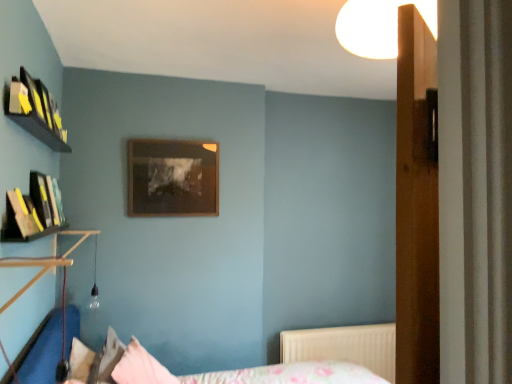
Question: From a real-world perspective, is floral fabric bed at lower center physically located above or below white textured radiator at lower right?

Choices:
 (A) above
 (B) below

Answer: (A)

Question: Looking at the image, does floral fabric bed at lower center seem bigger or smaller compared to white textured radiator at lower right?

Choices:
 (A) small
 (B) big

Answer: (B)

Question: Which object is positioned closest to the white glossy light fixture at upper center?

Choices:
 (A) pink fabric pillow at lower center, the 2th pillow in the left-to-right sequence
 (B) floral fabric bed at lower center
 (C) fluffy pink pillow at lower left, the 1th pillow when ordered from left to right
 (D) yellow paper at upper left
 (E) wooden picture frame at center

Answer: (D)

Question: Which of these objects is positioned closest to the white textured radiator at lower right?

Choices:
 (A) yellow paper at upper left
 (B) white glossy light fixture at upper center
 (C) floral fabric bed at lower center
 (D) pink fabric pillow at lower center, the 2th pillow in the left-to-right sequence
 (E) wooden picture frame at center

Answer: (C)